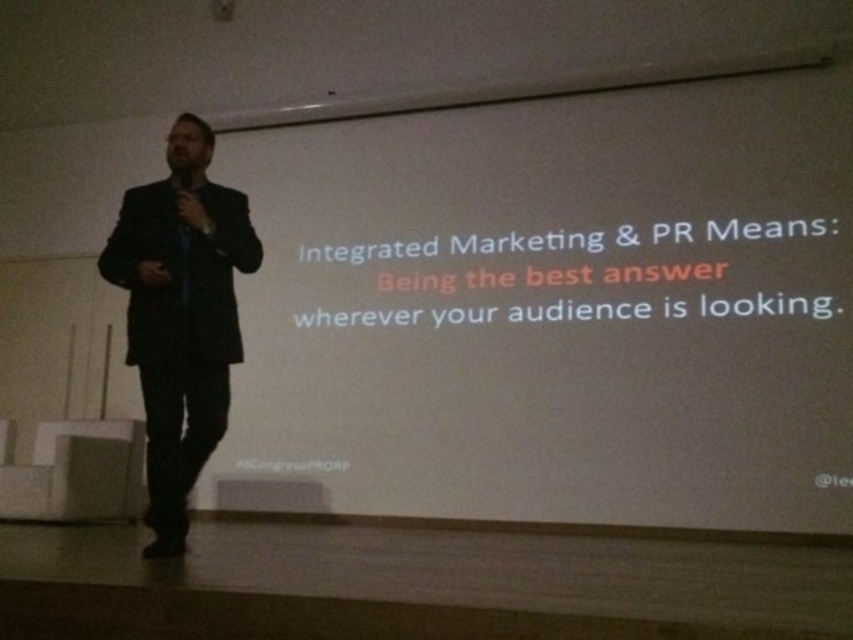
Can you confirm if dark suit at left is thinner than black matte microphone at left?

No, dark suit at left is not thinner than black matte microphone at left.

Is point (165, 237) in front of point (180, 172)?

Yes, point (165, 237) is closer to viewer.

The image size is (853, 640). What do you see at coordinates (180, 317) in the screenshot? I see `dark suit at left` at bounding box center [180, 317].

The image size is (853, 640). Identify the location of dark suit at left. (180, 317).